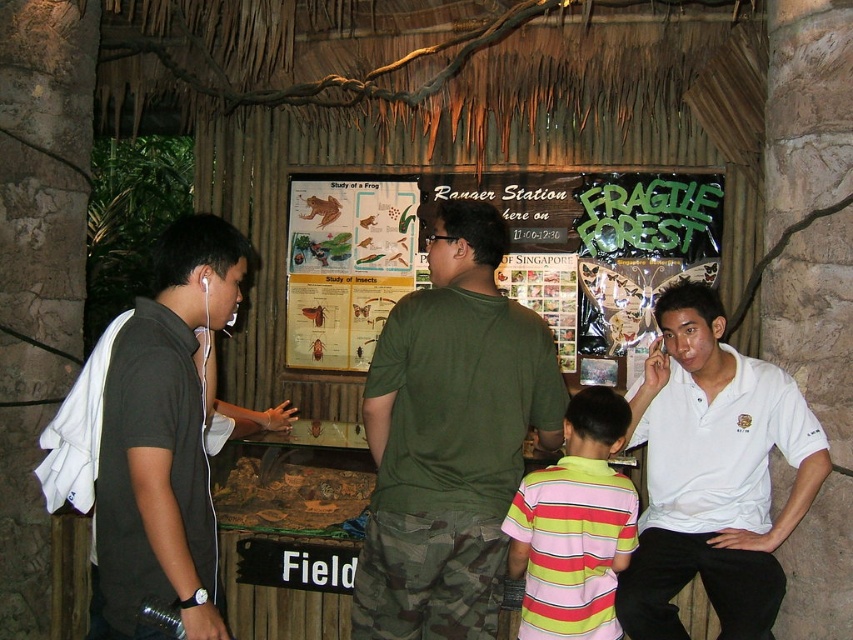
Question: Is green matte shirt at center above black matte shirt at left?

Choices:
 (A) no
 (B) yes

Answer: (A)

Question: Which point is farther to the camera?

Choices:
 (A) (106, 401)
 (B) (389, 321)

Answer: (B)

Question: Among these points, which one is nearest to the camera?

Choices:
 (A) (798, 472)
 (B) (531, 577)

Answer: (B)

Question: Observing the image, what is the correct spatial positioning of black matte shirt at left in reference to striped cotton shirt at center?

Choices:
 (A) above
 (B) below

Answer: (A)

Question: Which of the following is the farthest from the observer?

Choices:
 (A) black matte shirt at left
 (B) green matte shirt at center
 (C) striped cotton shirt at center

Answer: (C)

Question: Does green matte shirt at center have a larger size compared to striped cotton shirt at center?

Choices:
 (A) yes
 (B) no

Answer: (A)